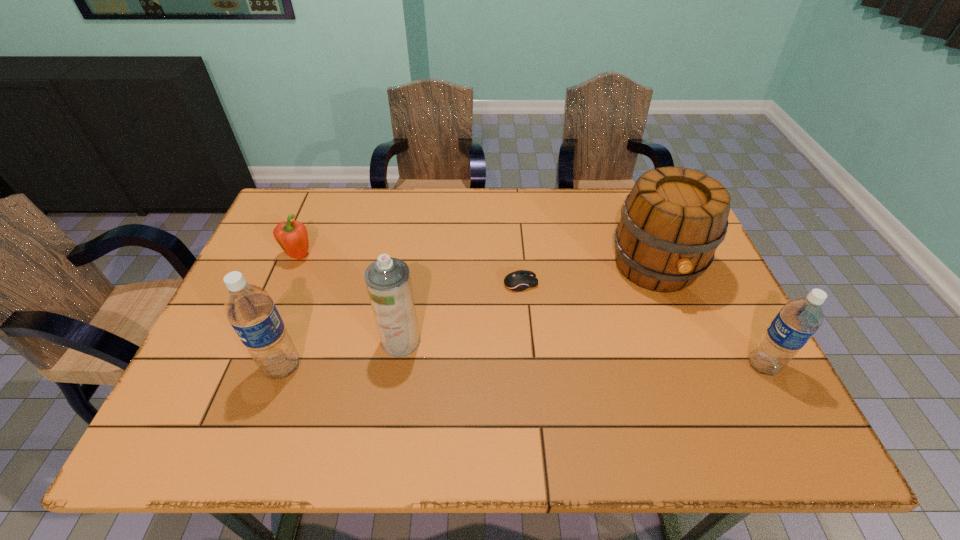
Please determine a free point for an extra water_bottle to ensure balance. Please provide its 2D coordinates. Your answer should be formatted as a tuple, i.e. [(x, y)], where the tuple contains the x and y coordinates of a point satisfying the conditions above.

[(523, 366)]